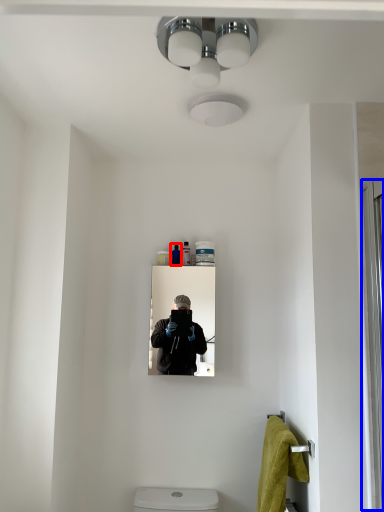
Question: Which object is closer to the camera taking this photo, toiletry (highlighted by a red box) or screen door (highlighted by a blue box)?

Choices:
 (A) toiletry
 (B) screen door

Answer: (B)